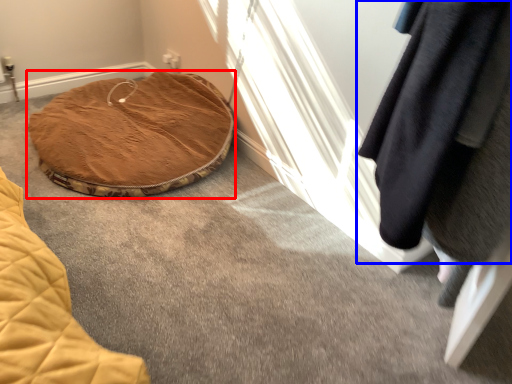
Question: Which of the following is the farthest to the observer, furniture (highlighted by a red box) or clothing (highlighted by a blue box)?

Choices:
 (A) furniture
 (B) clothing

Answer: (A)